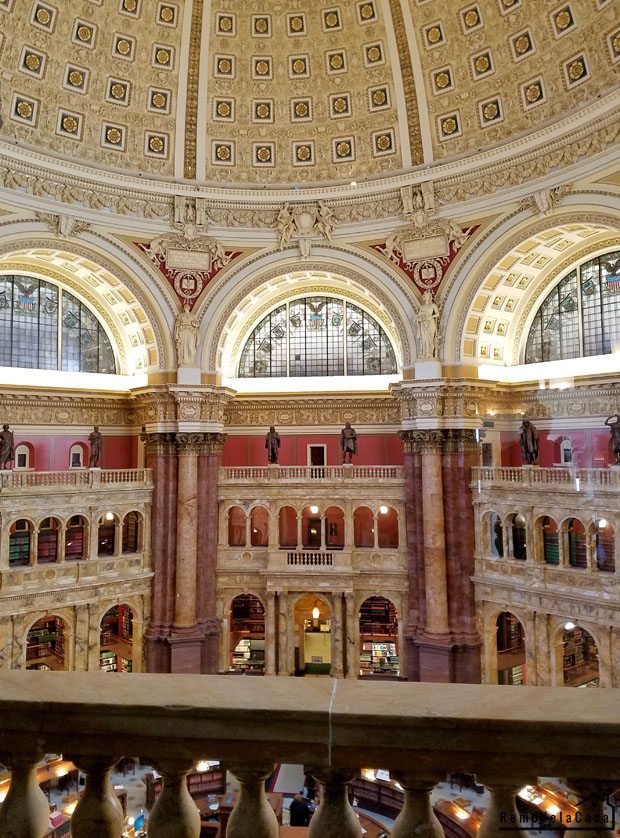
The image size is (620, 838). What are the coordinates of `wall` in the screenshot? It's located at (60, 445), (291, 446), (580, 441).